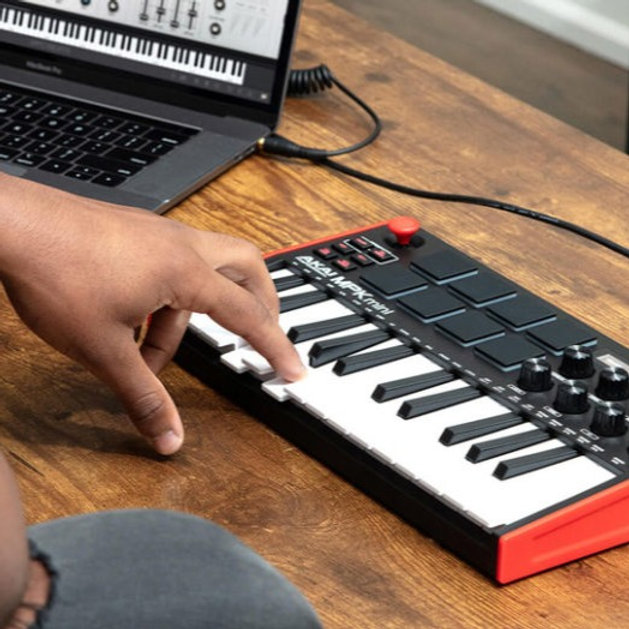
Locate an element on the screen. The width and height of the screenshot is (629, 629). knobs is located at coordinates (540, 370), (592, 352), (621, 382), (582, 415), (604, 428).